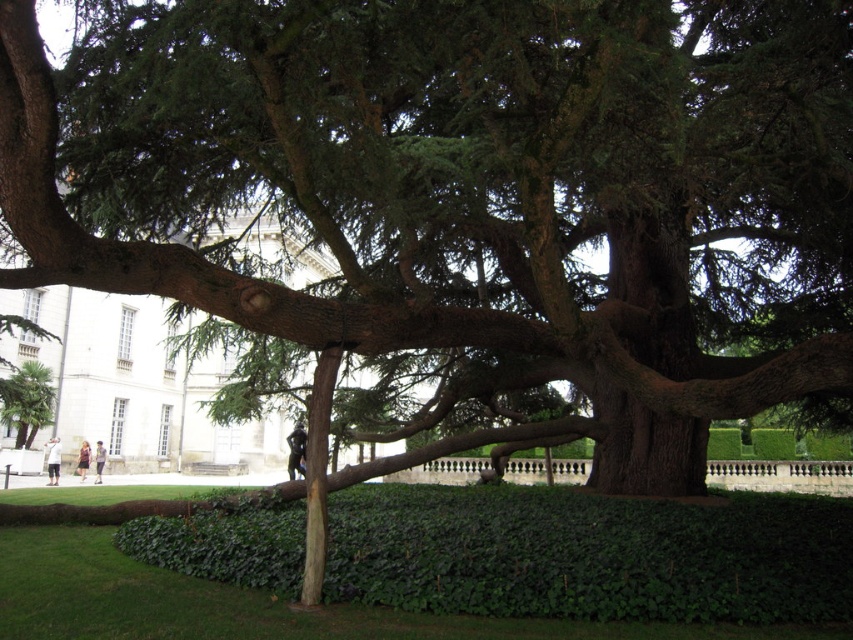
You are standing in a garden and want to take a photo of the brown rough bark at center. If your camera can focus on objects up to 35 meters away, will it be able to capture the bark clearly?

The brown rough bark at center is 34.95 meters away from the viewer. Since the camera can focus up to 35 meters, it will be able to capture the bark clearly as the distance is within range.

Based on the photo, you are standing in the garden looking at the tree and the hedge. You notice two points marked in the image. Which of the two points, point (712, 557) or point (624, 285), is closer to you?

Point (712, 557) is closer to the camera than point (624, 285).